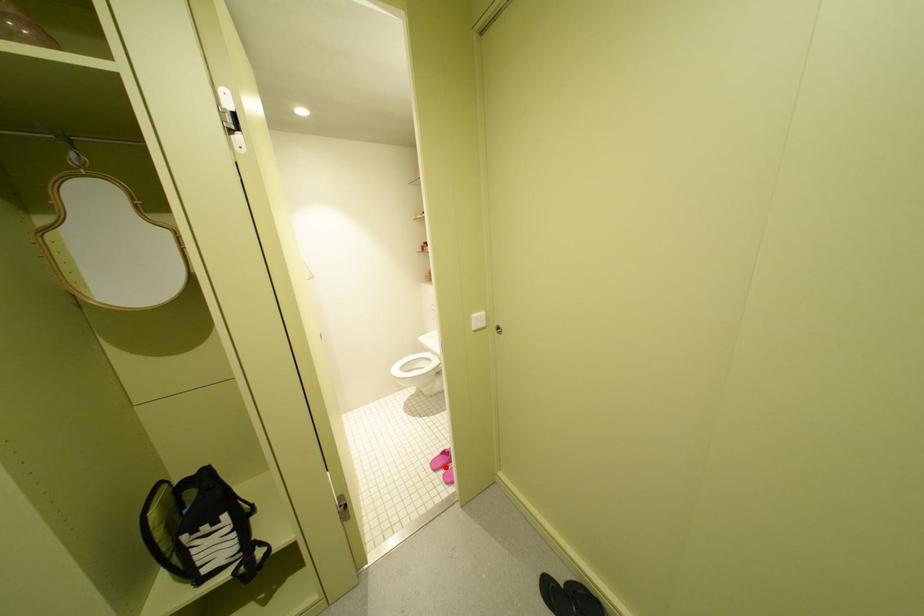
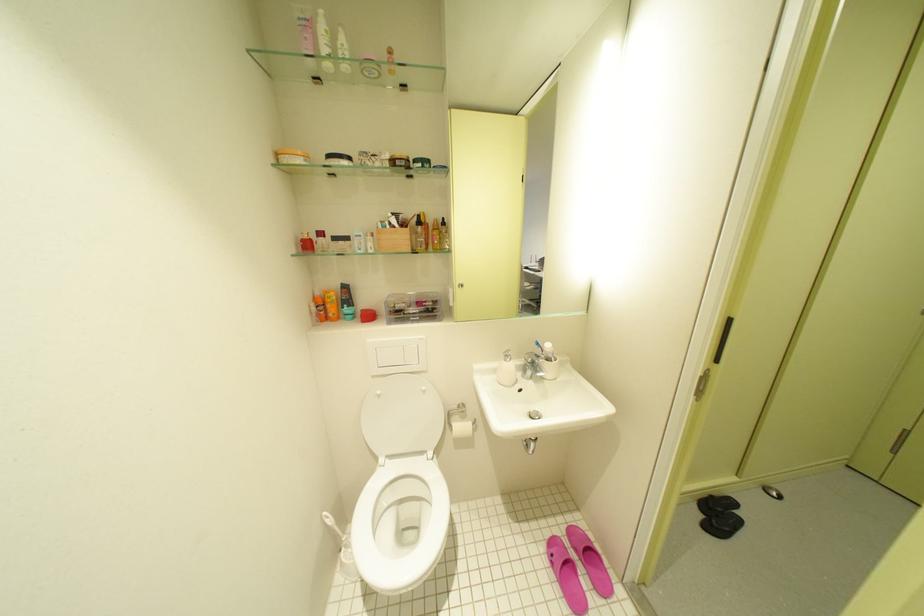
Find the pixel in the second image that matches the highlighted location in the first image.

(587, 604)